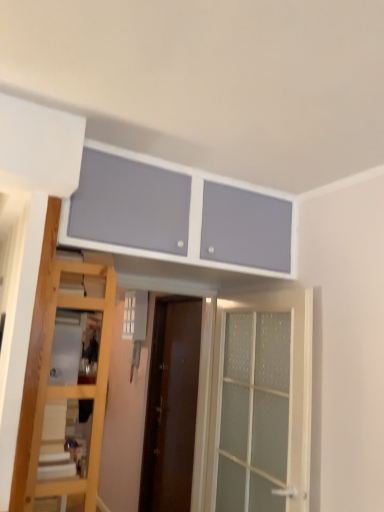
Question: Is clear glass door at center, arranged as the first door when viewed from the front, wider or thinner than brown wooden door at center, placed as the first door when sorted from back to front?

Choices:
 (A) thin
 (B) wide

Answer: (A)

Question: In terms of size, does clear glass door at center, which is counted as the 2th door, starting from the left, appear bigger or smaller than brown wooden door at center, placed as the first door when sorted from back to front?

Choices:
 (A) big
 (B) small

Answer: (B)

Question: Which object is positioned farthest from the wooden ladder at lower left?

Choices:
 (A) matte white cabinet at upper center
 (B) brown wooden door at center, acting as the first door starting from the left
 (C) clear glass door at center, which is counted as the 2th door, starting from the left

Answer: (B)

Question: Which of these objects is positioned closest to the wooden ladder at lower left?

Choices:
 (A) clear glass door at center, arranged as the first door when viewed from the front
 (B) brown wooden door at center, the 2th door from the right
 (C) matte white cabinet at upper center

Answer: (C)